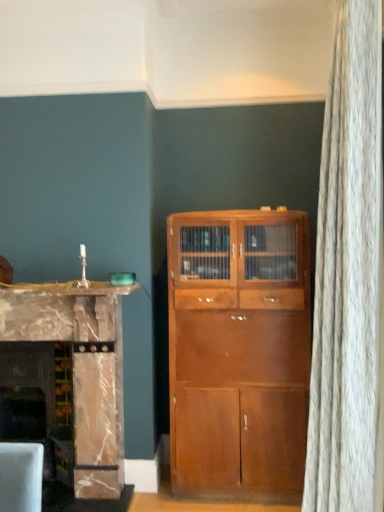
What do you see at coordinates (78, 369) in the screenshot? I see `marble fireplace at left` at bounding box center [78, 369].

What is the approximate width of marble fireplace at left?

It is 60.91 centimeters.

The height and width of the screenshot is (512, 384). What are the coordinates of `shiny brown cabinet at center` in the screenshot? It's located at [x=239, y=351].

Is the position of marble fireplace at left more distant than that of shiny brown cabinet at center?

No.

In terms of size, does marble fireplace at left appear bigger or smaller than shiny brown cabinet at center?

In the image, marble fireplace at left appears to be larger than shiny brown cabinet at center.

Is marble fireplace at left not near shiny brown cabinet at center?

marble fireplace at left is near shiny brown cabinet at center, not far away.

How many degrees apart are the facing directions of marble fireplace at left and shiny brown cabinet at center?

The angle between the facing direction of marble fireplace at left and the facing direction of shiny brown cabinet at center is 0.126 degrees.

Does marble fireplace at left have a greater width compared to marble fireplace at left?

Indeed, marble fireplace at left has a greater width compared to marble fireplace at left.

Is marble fireplace at left far from marble fireplace at left?

They are positioned close to each other.

Where is `cabinetry that appears behind the marble fireplace at left`? The height and width of the screenshot is (512, 384). cabinetry that appears behind the marble fireplace at left is located at coordinates (78, 369).

Which object is more forward, shiny brown cabinet at center or marble fireplace at left?

marble fireplace at left is more forward.

Is shiny brown cabinet at center touching marble fireplace at left?

shiny brown cabinet at center is not next to marble fireplace at left, and they're not touching.

Is shiny brown cabinet at center thinner than marble fireplace at left?

In fact, shiny brown cabinet at center might be wider than marble fireplace at left.

Is shiny brown cabinet at center to the left of marble fireplace at left from the viewer's perspective?

In fact, shiny brown cabinet at center is to the right of marble fireplace at left.

Is shiny brown cabinet at center wider than marble fireplace at left?

No, shiny brown cabinet at center is not wider than marble fireplace at left.

At what (x,y) coordinates should I click in order to perform the action: click on cabinetry that appears on the left of shiny brown cabinet at center. Please return your answer as a coordinate pair (x, y). Looking at the image, I should click on (78, 369).

Is shiny brown cabinet at center positioned behind marble fireplace at left?

Yes, shiny brown cabinet at center is behind marble fireplace at left.

Can you see shiny brown cabinet at center touching marble fireplace at left?

No, shiny brown cabinet at center is not beside marble fireplace at left.

How distant is marble fireplace at left from marble fireplace at left?

The distance of marble fireplace at left from marble fireplace at left is 14.28 inches.

This screenshot has height=512, width=384. Identify the location of cabinetry beneath the marble fireplace at left (from a real-world perspective). (78, 369).

From a real-world perspective, who is located lower, marble fireplace at left or marble fireplace at left?

marble fireplace at left.

Between marble fireplace at left and marble fireplace at left, which one has more height?

With more height is marble fireplace at left.

Is marble fireplace at left positioned far away from shiny brown cabinet at center?

No, marble fireplace at left is not far away from shiny brown cabinet at center.

Is marble fireplace at left surrounding shiny brown cabinet at center?

No, shiny brown cabinet at center is located outside of marble fireplace at left.

Considering the sizes of marble fireplace at left and shiny brown cabinet at center in the image, is marble fireplace at left taller or shorter than shiny brown cabinet at center?

Considering their sizes, marble fireplace at left has less height than shiny brown cabinet at center.

Would you say marble fireplace at left is to the left or to the right of shiny brown cabinet at center in the picture?

In the image, marble fireplace at left appears on the left side of shiny brown cabinet at center.

You are a GUI agent. You are given a task and a screenshot of the screen. Output one action in this format:
    pyautogui.click(x=<x>, y=<y>)
    Task: Click on the cabinetry that appears on the left of shiny brown cabinet at center
    The width and height of the screenshot is (384, 512).
    Given the screenshot: What is the action you would take?
    pyautogui.click(x=78, y=369)

The width and height of the screenshot is (384, 512). Find the location of `counter top that is in front of the marble fireplace at left`. counter top that is in front of the marble fireplace at left is located at coordinates (70, 288).

In the scene shown: Looking at the image, which one is located closer to shiny brown cabinet at center, marble fireplace at left or marble fireplace at left?

Among the two, marble fireplace at left is located nearer to shiny brown cabinet at center.

From the image, which object appears to be nearer to marble fireplace at left, marble fireplace at left or shiny brown cabinet at center?

Among the two, marble fireplace at left is located nearer to marble fireplace at left.

Based on the photo, from the image, which object appears to be farther from marble fireplace at left, marble fireplace at left or shiny brown cabinet at center?

Based on the image, shiny brown cabinet at center appears to be further to marble fireplace at left.

Looking at this image, estimate the real-world distances between objects in this image. Which object is closer to shiny brown cabinet at center, marble fireplace at left or marble fireplace at left?

marble fireplace at left is closer to shiny brown cabinet at center.

Based on their spatial positions, is shiny brown cabinet at center or marble fireplace at left closer to marble fireplace at left?

Among the two, marble fireplace at left is located nearer to marble fireplace at left.

Which object lies nearer to the anchor point marble fireplace at left, shiny brown cabinet at center or marble fireplace at left?

marble fireplace at left lies closer to marble fireplace at left than the other object.

You are a GUI agent. You are given a task and a screenshot of the screen. Output one action in this format:
    pyautogui.click(x=<x>, y=<y>)
    Task: Click on the counter top between marble fireplace at left and shiny brown cabinet at center from left to right
    The width and height of the screenshot is (384, 512).
    Given the screenshot: What is the action you would take?
    pyautogui.click(x=70, y=288)